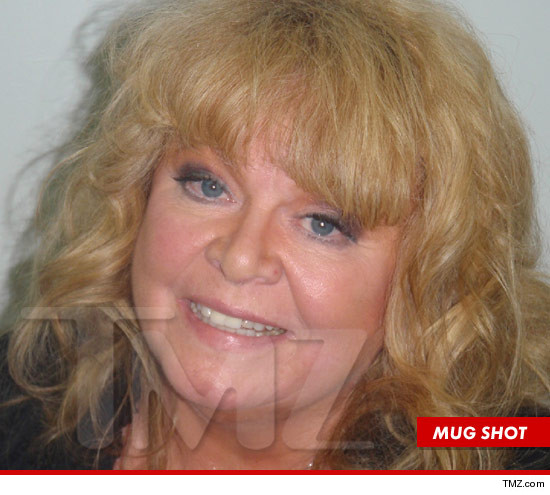
At what (x,y) coordinates should I click in order to perform the action: click on wall. Please return your answer as a coordinate pair (x, y). Looking at the image, I should click on (531, 79).